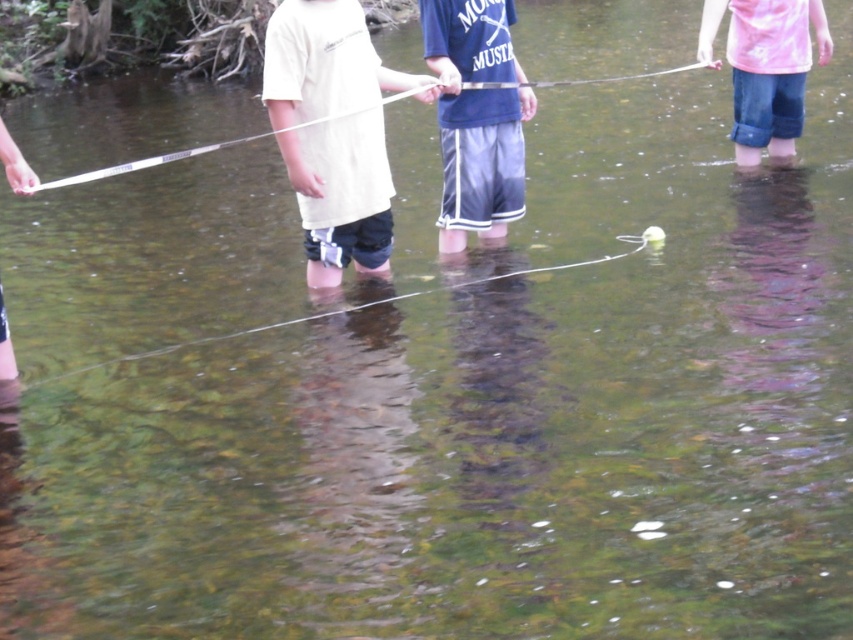
You are standing at the point labeled as point (489, 211) and want to move towards the point labeled as point (369, 132). Which direction should you move relative to your current position?

You should move forward because point (369, 132) is in front of point (489, 211).

You are a photographer trying to capture the scene of three people fishing in a river. You notice the white matte shirt at center and the glossy blue shorts at center. Which one is positioned lower in the image?

The white matte shirt at center is located below the glossy blue shorts at center, so it is positioned lower in the image.